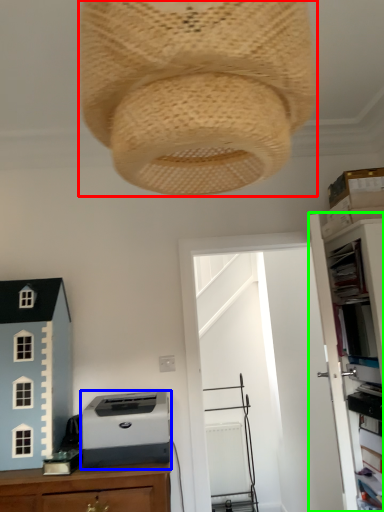
Question: Which is nearer to the lamp (highlighted by a red box)? printer (highlighted by a blue box) or file cabinet (highlighted by a green box).

Choices:
 (A) printer
 (B) file cabinet

Answer: (A)